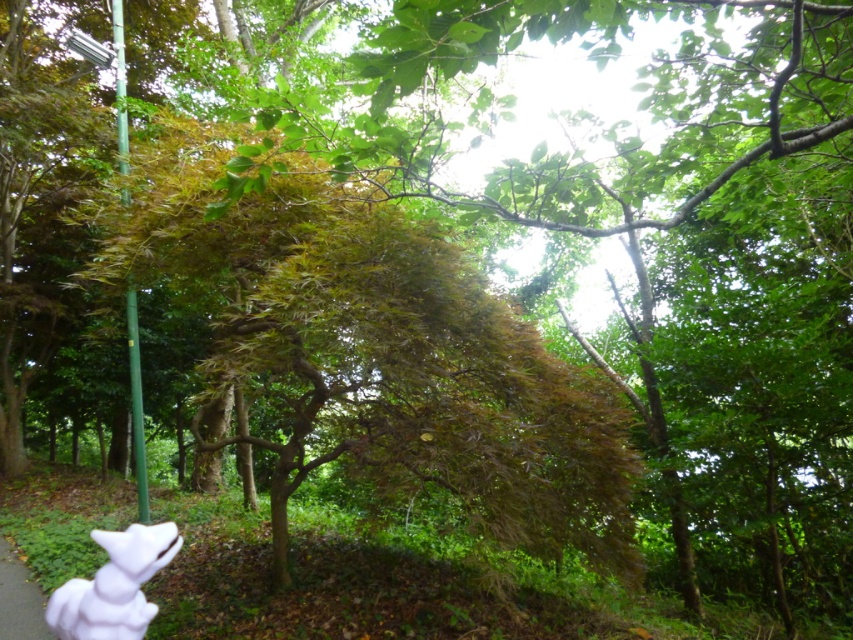
In the forest scene, you see a white matte fox at lower left and green grass at lower left. Which object is taller?

The white matte fox at lower left is taller than the green grass at lower left.

You are a hiker who wants to place a 1.5 meter long backpack between the white matte fox at lower left and the green grass at lower left. Can you fit the backpack in that space?

The distance between the white matte fox at lower left and the green grass at lower left is 1.86 meters, so the 1.5 meter long backpack can fit in the space between them.